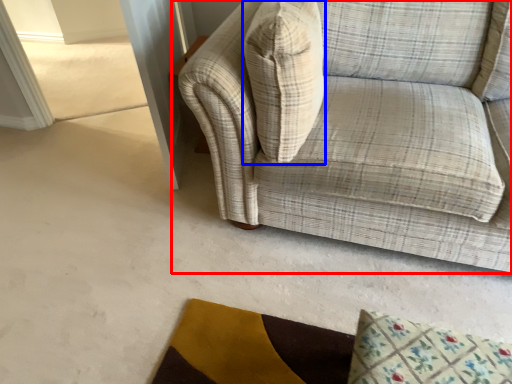
Question: Which object appears farthest to the camera in this image, studio couch (highlighted by a red box) or throw pillow (highlighted by a blue box)?

Choices:
 (A) studio couch
 (B) throw pillow

Answer: (B)